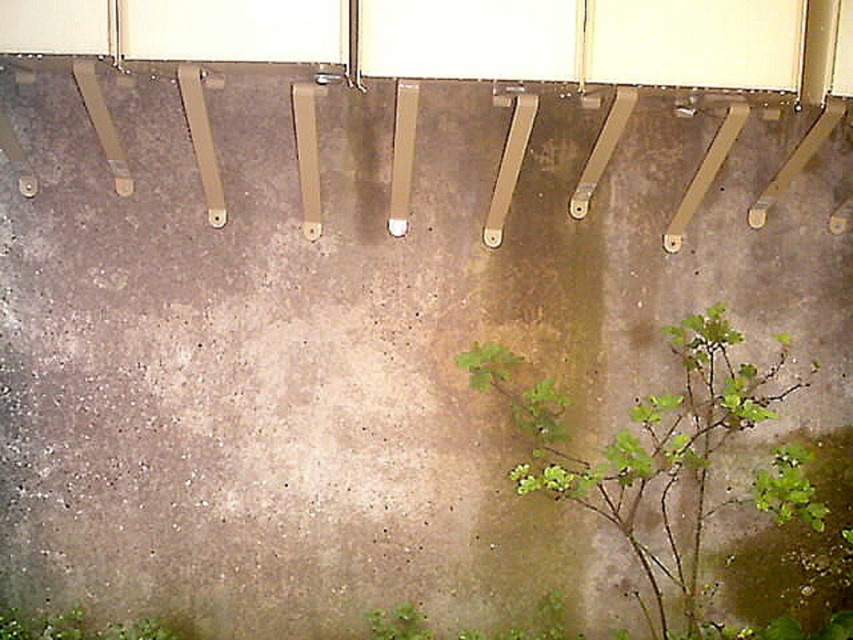
Is point (548, 449) behind point (427, 627)?

No.

Who is higher up, green leafy plant at lower right or green leafy plant at lower center?

green leafy plant at lower right

Which is behind, point (701, 394) or point (395, 616)?

The point (701, 394) is more distant.

At what (x,y) coordinates should I click in order to perform the action: click on green leafy plant at lower right. Please return your answer as a coordinate pair (x, y). Looking at the image, I should click on (646, 449).

Who is positioned more to the right, green leafy plant at lower left or green leafy plant at lower center?

green leafy plant at lower center is more to the right.

This screenshot has width=853, height=640. Describe the element at coordinates (78, 627) in the screenshot. I see `green leafy plant at lower left` at that location.

Where is `green leafy plant at lower left`? The height and width of the screenshot is (640, 853). green leafy plant at lower left is located at coordinates (78, 627).

Is green leafy plant at lower right to the right of green leafy plant at lower left from the viewer's perspective?

Correct, you'll find green leafy plant at lower right to the right of green leafy plant at lower left.

Who is more distant from viewer, (669, 340) or (144, 634)?

Point (669, 340)

Locate an element on the screen. green leafy plant at lower right is located at coordinates (646, 449).